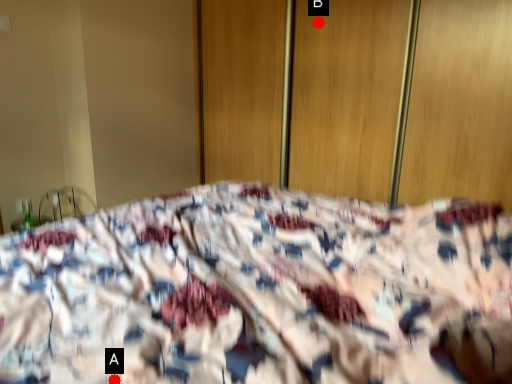
Question: Two points are circled on the image, labeled by A and B beside each circle. Which point is closer to the camera taking this photo?

Choices:
 (A) A is closer
 (B) B is closer

Answer: (A)